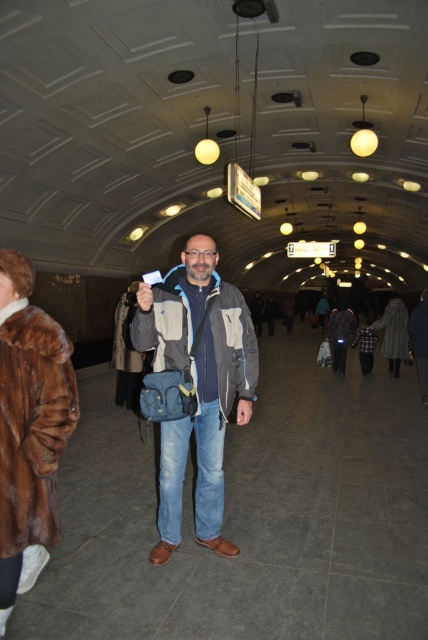
This screenshot has height=640, width=428. What do you see at coordinates (196, 385) in the screenshot?
I see `matte gray jacket at center` at bounding box center [196, 385].

Between point (169, 554) and point (38, 348), which one is positioned in front?

Point (38, 348)

Is point (247, 342) less distant than point (8, 369)?

No, it is not.

This screenshot has width=428, height=640. What are the coordinates of `matte gray jacket at center` in the screenshot? It's located at (196, 385).